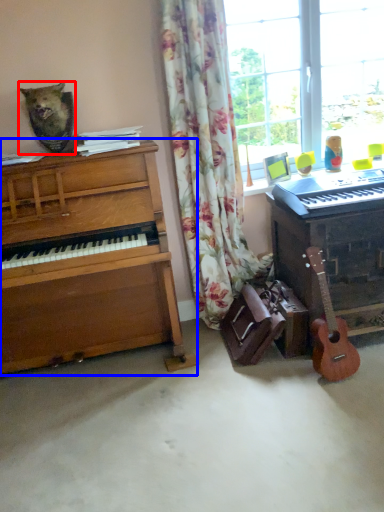
Question: Among these objects, which one is farthest to the camera, animal (highlighted by a red box) or piano (highlighted by a blue box)?

Choices:
 (A) animal
 (B) piano

Answer: (A)